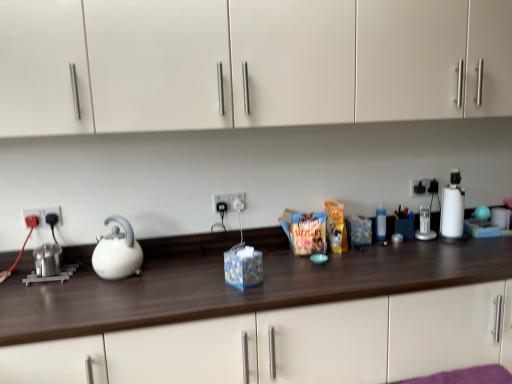
Question: From a real-world perspective, does white plastic blender at right sit lower than polished stainless steel kettle at left?

Choices:
 (A) no
 (B) yes

Answer: (A)

Question: Can you confirm if white plastic blender at right is bigger than polished stainless steel kettle at left?

Choices:
 (A) yes
 (B) no

Answer: (A)

Question: Can you confirm if white plastic blender at right is positioned to the right of polished stainless steel kettle at left?

Choices:
 (A) no
 (B) yes

Answer: (B)

Question: Is white plastic blender at right at the left side of polished stainless steel kettle at left?

Choices:
 (A) no
 (B) yes

Answer: (A)

Question: Can you confirm if white plastic blender at right is smaller than polished stainless steel kettle at left?

Choices:
 (A) no
 (B) yes

Answer: (A)

Question: Looking at the image, does white matte cabinet at upper center seem bigger or smaller compared to transparent plastic bottle at right?

Choices:
 (A) small
 (B) big

Answer: (B)

Question: Looking at their shapes, would you say white matte cabinet at upper center is wider or thinner than transparent plastic bottle at right?

Choices:
 (A) wide
 (B) thin

Answer: (A)

Question: Is white matte cabinet at upper center in front of or behind transparent plastic bottle at right in the image?

Choices:
 (A) behind
 (B) front

Answer: (B)

Question: Is white matte cabinet at upper center taller or shorter than transparent plastic bottle at right?

Choices:
 (A) tall
 (B) short

Answer: (A)

Question: Is point (51, 210) positioned closer to the camera than point (420, 107)?

Choices:
 (A) closer
 (B) farther

Answer: (B)

Question: Is black plastic electrical outlet at left, the 3th electric outlet in the right-to-left sequence, to the left or to the right of white matte cabinet at upper center in the image?

Choices:
 (A) right
 (B) left

Answer: (B)

Question: Looking at their shapes, would you say black plastic electrical outlet at left, which ranks as the third electric outlet in back-to-front order, is wider or thinner than white matte cabinet at upper center?

Choices:
 (A) thin
 (B) wide

Answer: (A)

Question: From the image's perspective, is black plastic electrical outlet at left, the 3th electric outlet in the right-to-left sequence, above or below white matte cabinet at upper center?

Choices:
 (A) above
 (B) below

Answer: (B)

Question: Considering the relative positions of white glossy kettle at left and white plastic coffee machine at right in the image provided, is white glossy kettle at left to the left or to the right of white plastic coffee machine at right?

Choices:
 (A) right
 (B) left

Answer: (B)

Question: Is white glossy kettle at left taller or shorter than white plastic coffee machine at right?

Choices:
 (A) short
 (B) tall

Answer: (B)